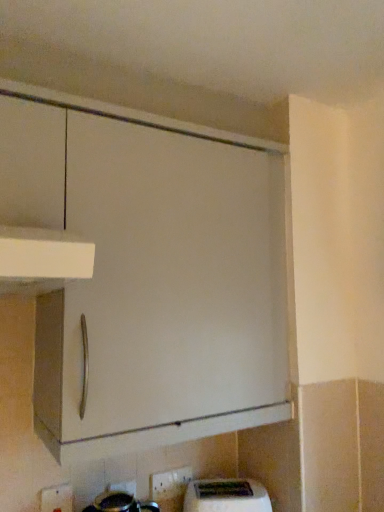
Question: Could you tell me if white plastic electric outlet at lower center, the 2th electric outlet when ordered from right to left, is turned towards white plastic toaster at lower center?

Choices:
 (A) no
 (B) yes

Answer: (A)

Question: From a real-world perspective, is white plastic electric outlet at lower center, arranged as the first electric outlet when viewed from the front, on top of white plastic toaster at lower center?

Choices:
 (A) yes
 (B) no

Answer: (A)

Question: From a real-world perspective, is white plastic electric outlet at lower center, which is the 1th electric outlet in left-to-right order, located beneath white plastic toaster at lower center?

Choices:
 (A) yes
 (B) no

Answer: (B)

Question: Does white plastic electric outlet at lower center, which is the 1th electric outlet in left-to-right order, have a smaller size compared to white plastic toaster at lower center?

Choices:
 (A) yes
 (B) no

Answer: (A)

Question: Considering the relative sizes of white plastic electric outlet at lower center, which is the 1th electric outlet in left-to-right order, and white plastic toaster at lower center in the image provided, is white plastic electric outlet at lower center, which is the 1th electric outlet in left-to-right order, thinner than white plastic toaster at lower center?

Choices:
 (A) no
 (B) yes

Answer: (B)

Question: Is white plastic electric outlet at lower center, arranged as the first electric outlet when viewed from the front, surrounding white plastic toaster at lower center?

Choices:
 (A) no
 (B) yes

Answer: (A)

Question: Does white plastic toaster at lower center appear on the left side of white plastic electric outlet at lower center, arranged as the first electric outlet when viewed from the front?

Choices:
 (A) yes
 (B) no

Answer: (B)

Question: Can you confirm if white plastic toaster at lower center is thinner than white plastic electric outlet at lower center, which is the 1th electric outlet in left-to-right order?

Choices:
 (A) no
 (B) yes

Answer: (A)

Question: Is white plastic toaster at lower center further to camera compared to white plastic electric outlet at lower center, which is the 1th electric outlet in left-to-right order?

Choices:
 (A) no
 (B) yes

Answer: (B)

Question: Can you confirm if white plastic toaster at lower center is wider than white plastic electric outlet at lower center, arranged as the first electric outlet when viewed from the front?

Choices:
 (A) no
 (B) yes

Answer: (B)

Question: Does white plastic toaster at lower center turn towards white plastic electric outlet at lower center, the 2th electric outlet when ordered from right to left?

Choices:
 (A) yes
 (B) no

Answer: (B)

Question: From a real-world perspective, does white plastic toaster at lower center stand above white plastic electric outlet at lower center, which is the 1th electric outlet in left-to-right order?

Choices:
 (A) yes
 (B) no

Answer: (B)

Question: Does white plastic electric outlet at lower center, arranged as the 2th electric outlet when viewed from the back, have a smaller size compared to white glossy electric outlet at lower center, which ranks as the 1th electric outlet in right-to-left order?

Choices:
 (A) yes
 (B) no

Answer: (B)